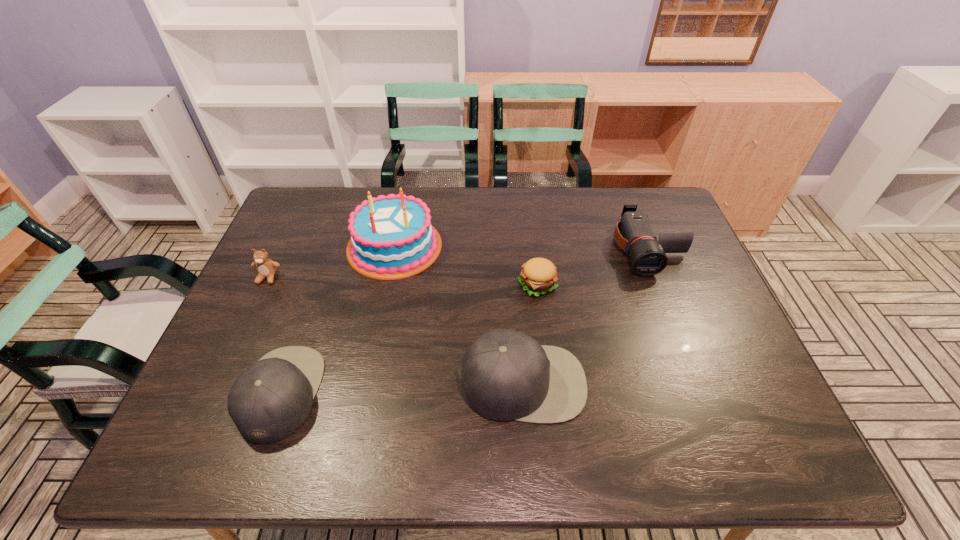
Find the location of a particular element. This screenshot has height=540, width=960. free space between the camcorder and the shorter cap is located at coordinates (465, 321).

Image resolution: width=960 pixels, height=540 pixels. I want to click on free spot between the left cap and the right cap, so click(401, 388).

Find the location of a particular element. The height and width of the screenshot is (540, 960). free spot between the taller cap and the teddy bear is located at coordinates [x=395, y=330].

Where is `free space between the second tallest object and the rightmost object`? This screenshot has height=540, width=960. free space between the second tallest object and the rightmost object is located at coordinates (585, 315).

Select which object appears as the third closest to the shortest object. Please provide its 2D coordinates. Your answer should be formatted as a tuple, i.e. [(x, y)], where the tuple contains the x and y coordinates of a point satisfying the conditions above.

[(391, 237)]

Locate an element on the screen. This screenshot has width=960, height=540. object that is the third nearest to the right cap is located at coordinates (633, 233).

Where is `free space that satisfies the following two spatial constraints: 1. on the front-facing side of the leftmost object; 2. on the right side of the shortest object`? The height and width of the screenshot is (540, 960). free space that satisfies the following two spatial constraints: 1. on the front-facing side of the leftmost object; 2. on the right side of the shortest object is located at coordinates (265, 285).